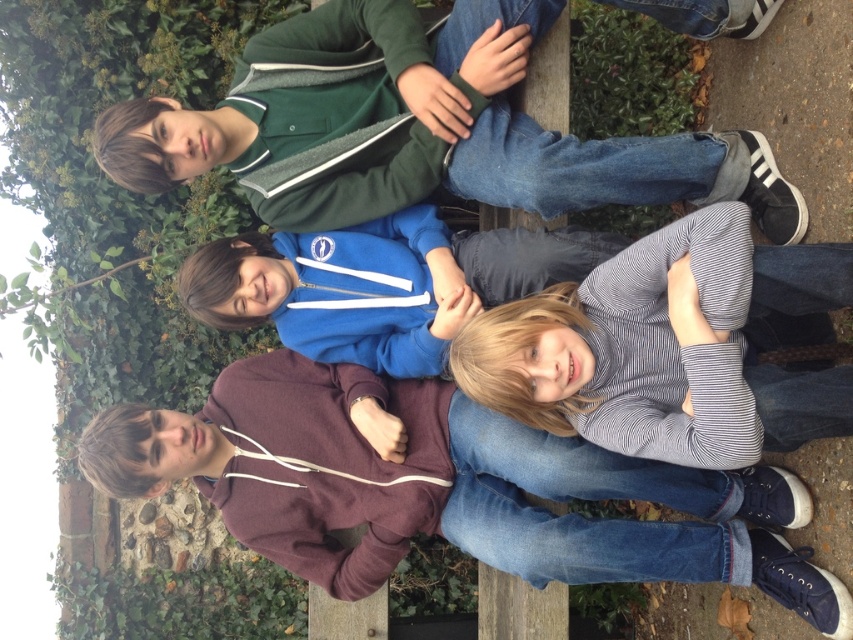
Identify the location of green fleece jacket at upper center. The width and height of the screenshot is (853, 640). (416, 129).

Is point (347, 19) positioned behind point (784, 252)?

Yes, it is behind point (784, 252).

Does point (538, 208) lie in front of point (706, 310)?

No, it is not.

Where is `green fleece jacket at upper center`? Image resolution: width=853 pixels, height=640 pixels. green fleece jacket at upper center is located at coordinates (416, 129).

Which is more to the right, striped cotton shirt at lower right or blue fleece jacket at center?

striped cotton shirt at lower right is more to the right.

Describe the element at coordinates (672, 348) in the screenshot. I see `striped cotton shirt at lower right` at that location.

Locate an element on the screen. This screenshot has width=853, height=640. striped cotton shirt at lower right is located at coordinates (672, 348).

Can you confirm if green fleece jacket at upper center is positioned to the right of blue fleece jacket at center?

Indeed, green fleece jacket at upper center is positioned on the right side of blue fleece jacket at center.

Does green fleece jacket at upper center appear over blue fleece jacket at center?

Yes.

Between point (296, 182) and point (415, 352), which one is positioned in front?

Point (296, 182)

In order to click on green fleece jacket at upper center in this screenshot , I will do `click(416, 129)`.